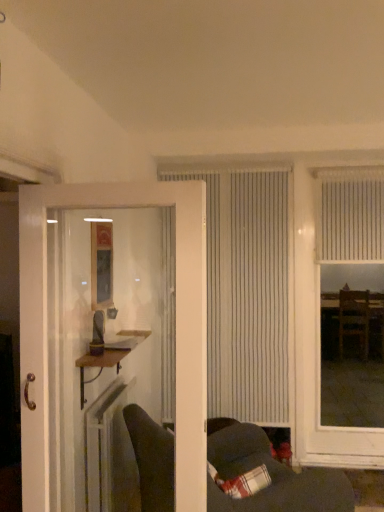
Locate an element on the screen. free spot above wooden shelf at left (from a real-world perspective) is located at coordinates (114, 345).